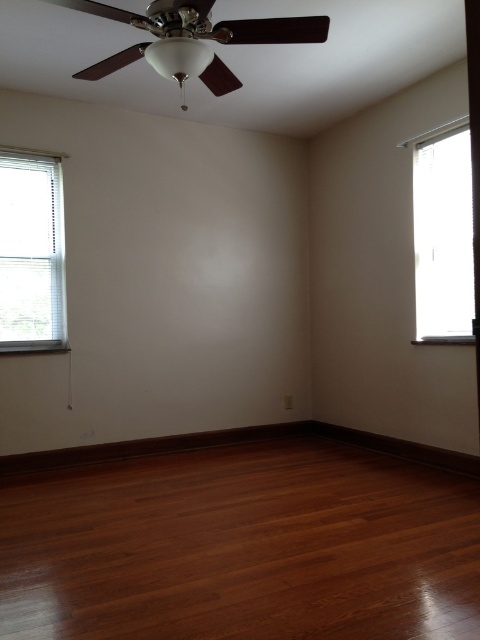
From the picture: Is brown glossy hardwood floor at lower center thinner than clear glass window at right?

No.

Does brown glossy hardwood floor at lower center appear under clear glass window at right?

Yes.

Who is more distant from viewer, (429, 547) or (424, 320)?

The point (424, 320) is behind.

Where is `brown glossy hardwood floor at lower center`? brown glossy hardwood floor at lower center is located at coordinates (241, 547).

Does point (26, 305) come in front of point (434, 157)?

That is False.

Can you confirm if white blinds at left is taller than clear glass window at right?

No.

In order to click on white blinds at left in this screenshot , I will do `click(32, 252)`.

What are the coordinates of `white blinds at left` in the screenshot? It's located at (32, 252).

Is brown glossy hardwood floor at lower center thinner than white blinds at left?

No.

Which of these two, brown glossy hardwood floor at lower center or white blinds at left, stands taller?

Standing taller between the two is white blinds at left.

Between point (121, 588) and point (46, 289), which one is positioned behind?

Positioned behind is point (46, 289).

Find the location of a particular element. This screenshot has height=640, width=480. brown glossy hardwood floor at lower center is located at coordinates (241, 547).